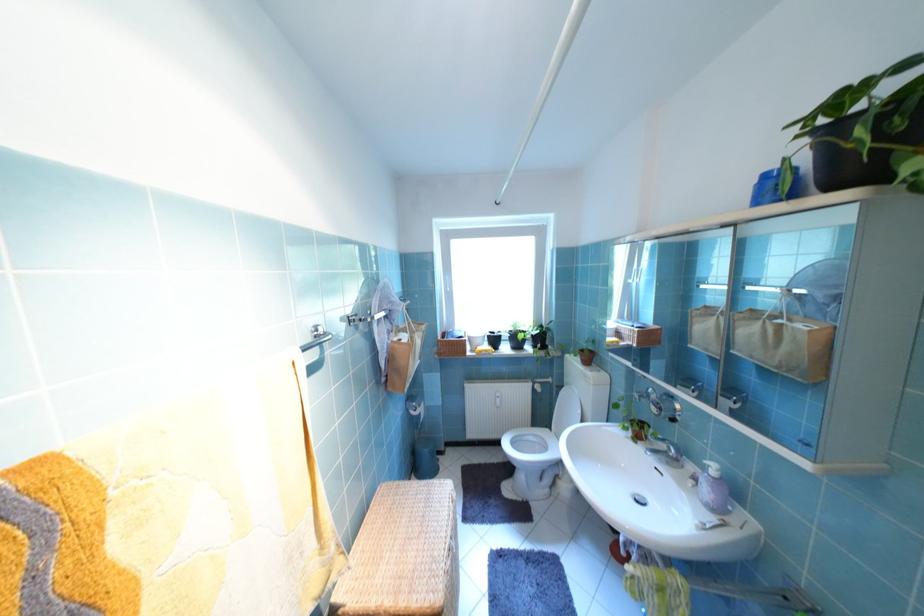
Where is `metal faucet lever`? metal faucet lever is located at coordinates (665, 440).